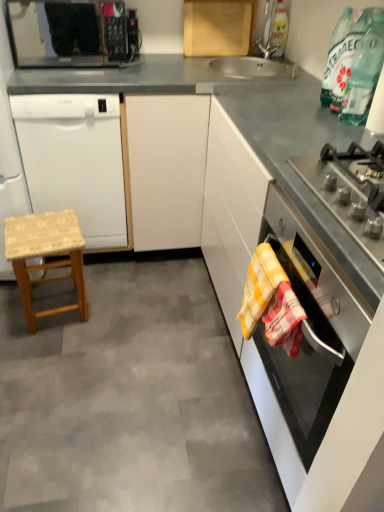
At what (x,y) coordinates should I click in order to perform the action: click on free space above woven wood stool at lower left (from a real-world perspective). Please return your answer as a coordinate pair (x, y). This screenshot has height=512, width=384. Looking at the image, I should click on (44, 229).